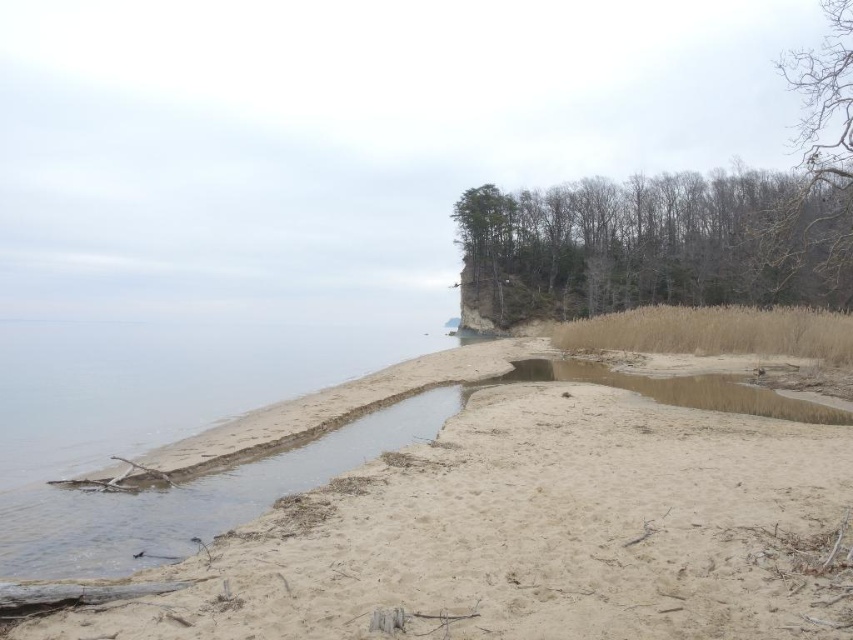
Question: Can you confirm if sandy beach at lower left is positioned above bare wood trees at upper right?

Choices:
 (A) no
 (B) yes

Answer: (A)

Question: Among these points, which one is nearest to the camera?

Choices:
 (A) 534,445
 (B) 844,49
 (C) 541,314

Answer: (A)

Question: Which object is closer to the camera taking this photo?

Choices:
 (A) bare wood trees at upper right
 (B) sandy beach at lower left
 (C) brown sandy puddle at lower right
 (D) bare branches at upper right

Answer: (B)

Question: Which object is closer to the camera taking this photo?

Choices:
 (A) bare branches at upper right
 (B) brown sandy puddle at lower right

Answer: (B)

Question: Observing the image, what is the correct spatial positioning of bare wood trees at upper right in reference to bare branches at upper right?

Choices:
 (A) below
 (B) above

Answer: (A)

Question: Is bare wood trees at upper right closer to the viewer compared to brown sandy puddle at lower right?

Choices:
 (A) no
 (B) yes

Answer: (A)